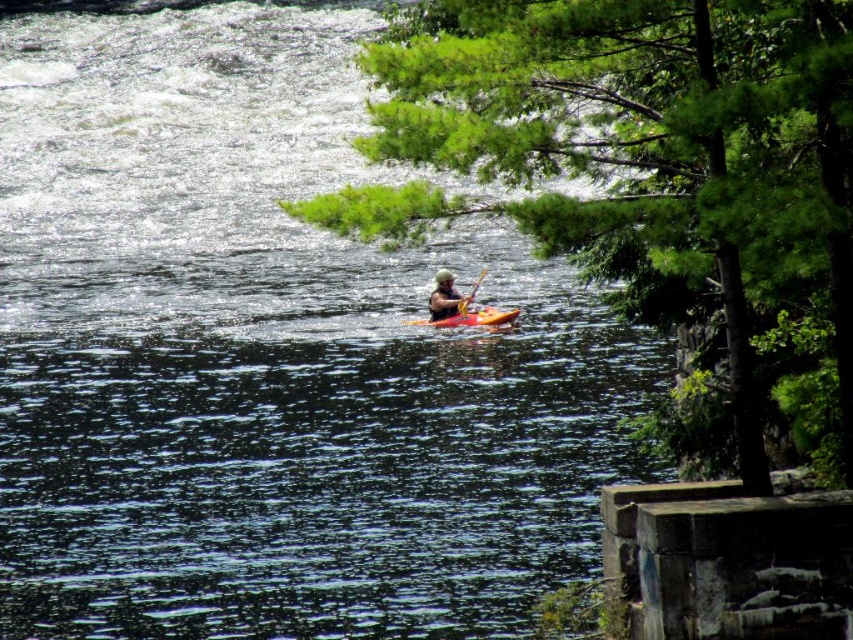
You are a photographer planning to take a photo of the green leafy tree at upper right and the matte green helmet at center in the kayaker scene. The minimum distance between objects for your camera to focus on both clearly is 10 meters. Can you capture both objects in focus?

The green leafy tree at upper right and matte green helmet at center are 13.88 meters apart, which exceeds the minimum required distance of 10 meters. Therefore, the camera can focus on both objects clearly.

You are a photographer trying to capture the kayaker in the image. You want to ensure both the matte green helmet at center and the yellow wood paddle at center are clearly visible in your shot. Which object should you focus on first to ensure both are in frame?

The matte green helmet at center is larger in size than the yellow wood paddle at center, so focusing on the larger matte green helmet at center first will help ensure both objects remain in frame.

You are a photographer planning to capture the kayaker and the trees in the image. Which object, the green leafy tree at upper right or the orange matte kayak at center, would require a wider lens to fully capture in the frame?

The green leafy tree at upper right requires a wider lens because its width is larger than the orange matte kayak at center.